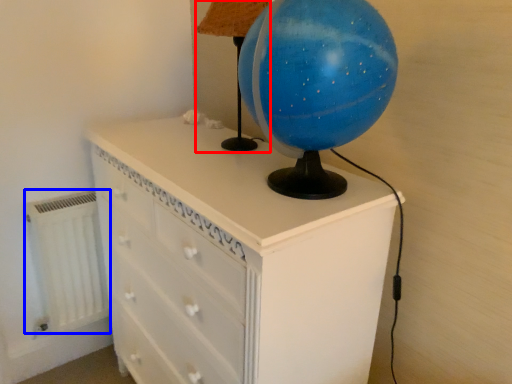
Question: Which of the following is the farthest to the observer, table lamp (highlighted by a red box) or radiator (highlighted by a blue box)?

Choices:
 (A) table lamp
 (B) radiator

Answer: (B)